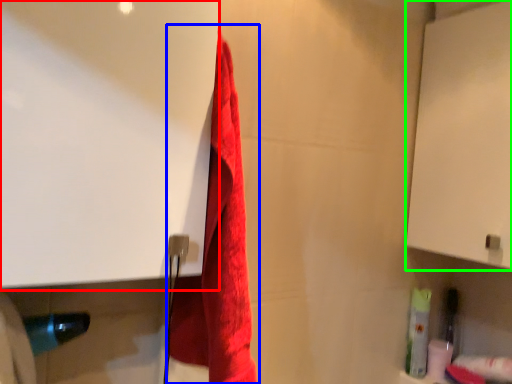
Question: Which is nearer to the screen door (highlighted by a red box)? towel (highlighted by a blue box) or screen door (highlighted by a green box).

Choices:
 (A) towel
 (B) screen door

Answer: (A)